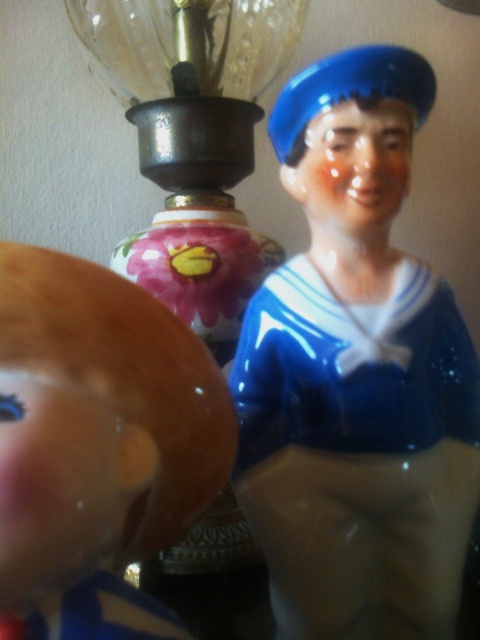
Question: Which object is closer to the camera taking this photo?

Choices:
 (A) transparent glass lamp at upper center
 (B) matte brown doll at left

Answer: (B)

Question: Can you confirm if blue glossy sailor figurine at upper right is thinner than matte brown doll at left?

Choices:
 (A) no
 (B) yes

Answer: (A)

Question: Which of the following is the farthest from the observer?

Choices:
 (A) transparent glass lamp at upper center
 (B) matte brown doll at left
 (C) blue glossy sailor figurine at upper right

Answer: (A)

Question: Does blue glossy sailor figurine at upper right come behind transparent glass lamp at upper center?

Choices:
 (A) no
 (B) yes

Answer: (A)

Question: Does blue glossy sailor figurine at upper right lie behind transparent glass lamp at upper center?

Choices:
 (A) no
 (B) yes

Answer: (A)

Question: Among these objects, which one is nearest to the camera?

Choices:
 (A) blue glossy sailor figurine at upper right
 (B) matte brown doll at left

Answer: (B)